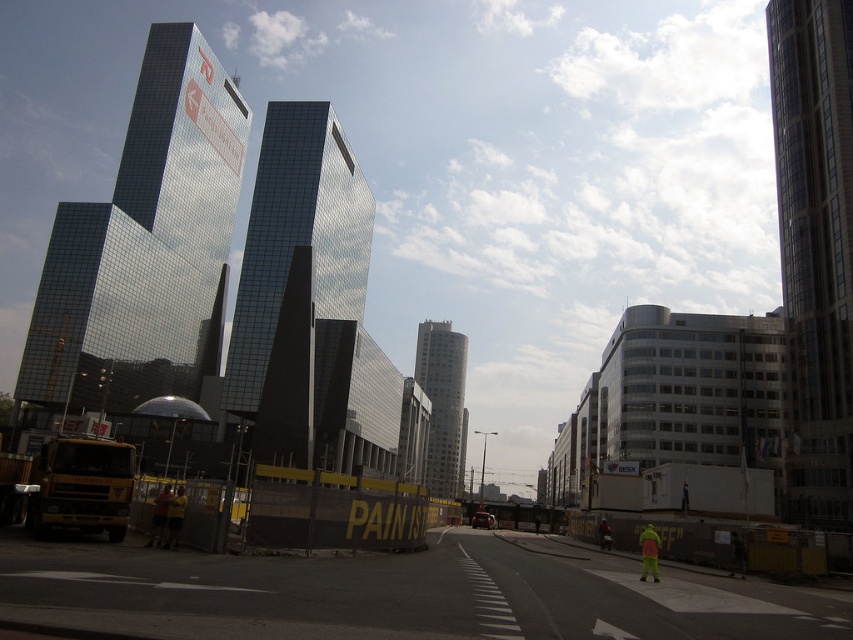
Does glassy reflective skyscraper at right have a greater height compared to neon yellow reflective jacket at lower right?

Yes, glassy reflective skyscraper at right is taller than neon yellow reflective jacket at lower right.

Which is in front, point (848, 426) or point (642, 547)?

Positioned in front is point (642, 547).

At what (x,y) coordinates should I click in order to perform the action: click on glassy reflective skyscraper at right. Please return your answer as a coordinate pair (x, y). Looking at the image, I should click on (815, 246).

Does reflective glass skyscraper at center have a smaller size compared to smooth glass tower at center?

Actually, reflective glass skyscraper at center might be larger than smooth glass tower at center.

Does reflective glass skyscraper at center have a greater height compared to smooth glass tower at center?

Indeed, reflective glass skyscraper at center has a greater height compared to smooth glass tower at center.

Between point (171, 221) and point (444, 358), which one is positioned in front?

Point (171, 221)

Where is `reflective glass skyscraper at center`? Image resolution: width=853 pixels, height=640 pixels. reflective glass skyscraper at center is located at coordinates (143, 241).

Image resolution: width=853 pixels, height=640 pixels. What are the coordinates of `reflective glass skyscraper at center` in the screenshot? It's located at (143, 241).

Does reflective glass skyscraper at center have a lesser height compared to neon yellow reflective jacket at lower right?

No, reflective glass skyscraper at center is not shorter than neon yellow reflective jacket at lower right.

Which is behind, point (82, 296) or point (648, 525)?

The point (82, 296) is behind.

Locate an element on the screen. The image size is (853, 640). reflective glass skyscraper at center is located at coordinates (143, 241).